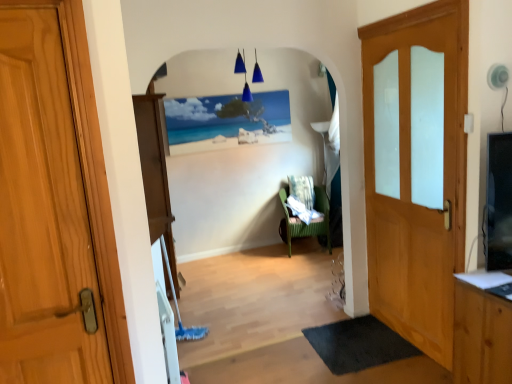
The image size is (512, 384). Find the location of `vacant space situated above black rubber mat at lower right (from a real-world perspective)`. vacant space situated above black rubber mat at lower right (from a real-world perspective) is located at coordinates (353, 341).